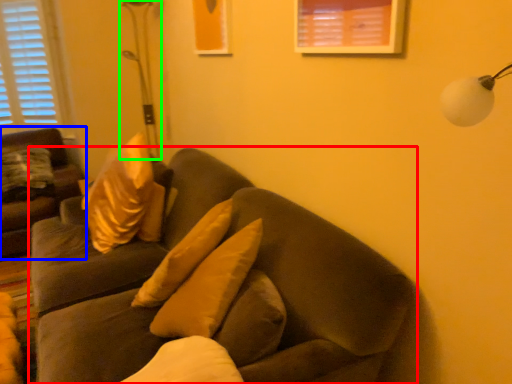
Question: Based on their relative distances, which object is farther from studio couch (highlighted by a red box)? Choose from studio couch (highlighted by a blue box) and table lamp (highlighted by a green box).

Choices:
 (A) studio couch
 (B) table lamp

Answer: (B)